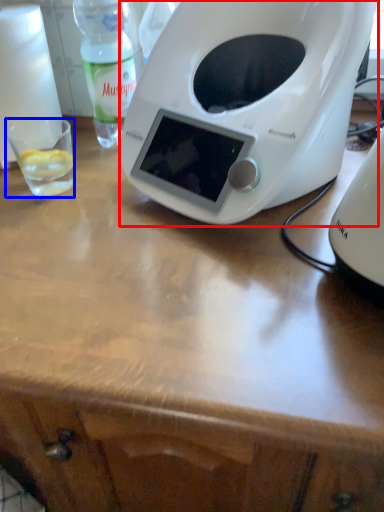
Question: Which object is further to the camera taking this photo, toaster (highlighted by a red box) or coffee cup (highlighted by a blue box)?

Choices:
 (A) toaster
 (B) coffee cup

Answer: (B)